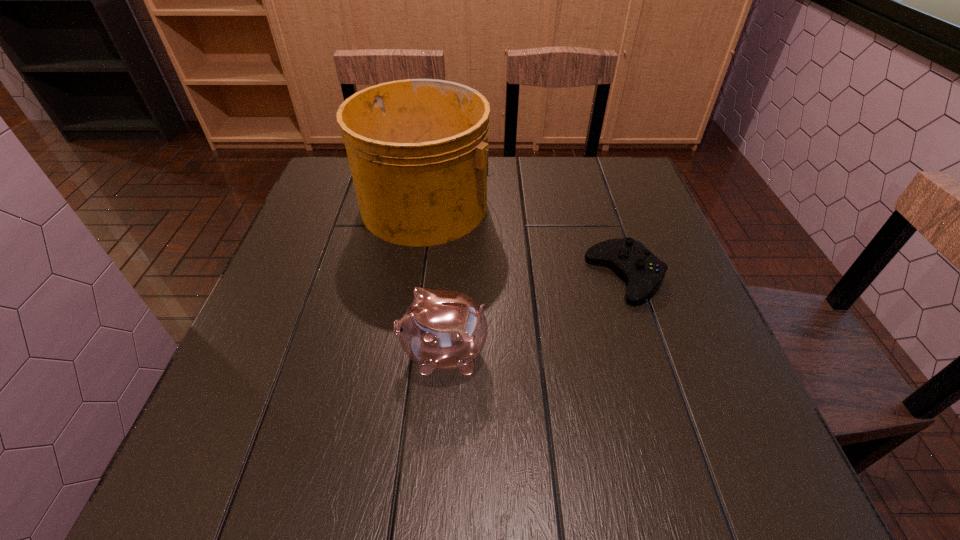
You are a GUI agent. You are given a task and a screenshot of the screen. Output one action in this format:
    pyautogui.click(x=<x>, y=<y>)
    Task: Click on the free space between the tallest object and the second shortest object
    
    Given the screenshot: What is the action you would take?
    pyautogui.click(x=435, y=279)

You are a GUI agent. You are given a task and a screenshot of the screen. Output one action in this format:
    pyautogui.click(x=<x>, y=<y>)
    Task: Click on the free space between the rightmost object and the tallest object
    Image resolution: width=960 pixels, height=540 pixels.
    Given the screenshot: What is the action you would take?
    pyautogui.click(x=526, y=241)

Image resolution: width=960 pixels, height=540 pixels. I want to click on vacant point located between the tallest object and the control, so click(x=526, y=241).

I want to click on free spot between the shortest object and the piggy bank, so click(535, 315).

The width and height of the screenshot is (960, 540). Find the location of `free spot between the bucket and the rightmost object`. free spot between the bucket and the rightmost object is located at coordinates (526, 241).

You are a GUI agent. You are given a task and a screenshot of the screen. Output one action in this format:
    pyautogui.click(x=<x>, y=<y>)
    Task: Click on the vacant area that lies between the farthest object and the second shortest object
    
    Given the screenshot: What is the action you would take?
    pyautogui.click(x=435, y=279)

What are the coordinates of `free spot between the farthest object and the second tallest object` in the screenshot? It's located at (435, 279).

This screenshot has height=540, width=960. Identify the location of unoccupied area between the tallest object and the piggy bank. (435, 279).

Locate an element on the screen. Image resolution: width=960 pixels, height=540 pixels. blank region between the bucket and the rightmost object is located at coordinates click(x=526, y=241).

Locate an element on the screen. The height and width of the screenshot is (540, 960). empty space between the farthest object and the nearest object is located at coordinates (435, 279).